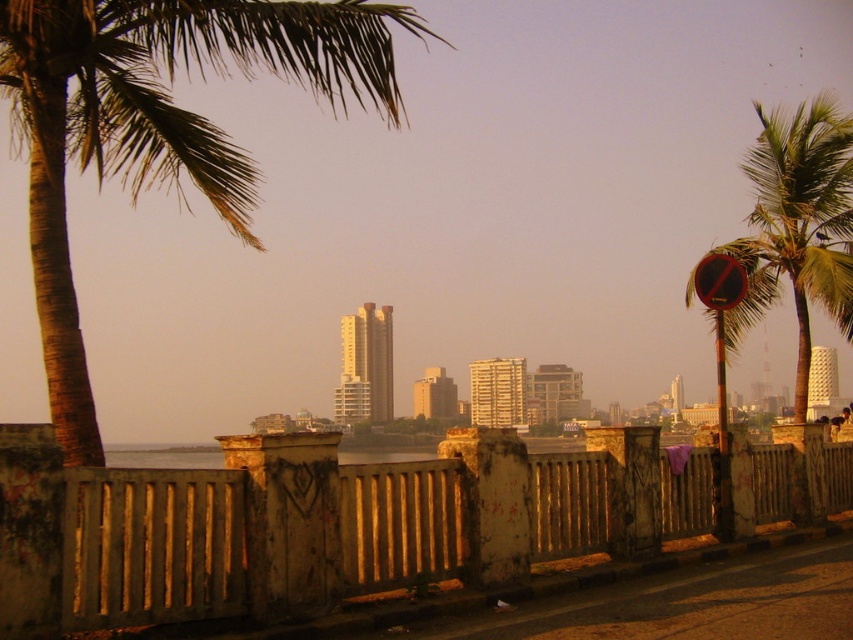
You are a photographer trying to capture a shot of the city skyline. You notice the brown textured palm tree at upper left and the red plastic sign at right. Which object might block your view of the skyline if positioned between you and the city?

The brown textured palm tree at upper left is taller than the red plastic sign at right, so it might block your view of the skyline if positioned between you and the city.

You are standing at the scenic overlook and want to take a photo of both the rusty metal fence at center and the green leafy palm tree at right. Which object should you focus on first to ensure both are in clear view?

You should focus on the rusty metal fence at center first because it is closer to the viewer than the green leafy palm tree at right, so adjusting focus from near to far will help both be in clear view.

You are standing at the railing looking out at the city skyline. There are two points marked in the scene, one at coordinates point (230,44) and another at point (733,262). Which point is nearer to your current position?

Point (230,44) is closer to the camera than point (733,262), so the point at coordinates point (230,44) is nearer to your current position.